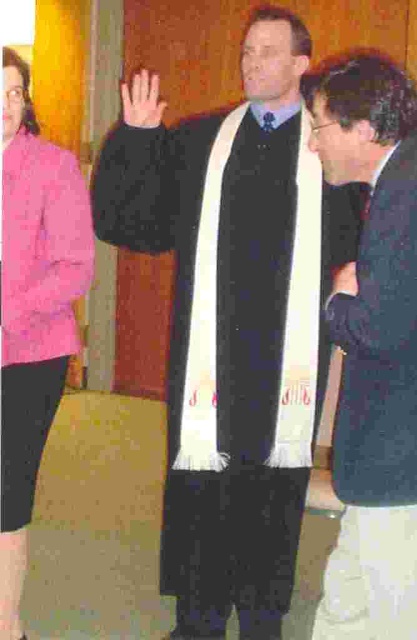
Question: In this image, where is white wool scarf at center located relative to smooth skin hand at center?

Choices:
 (A) below
 (B) above

Answer: (A)

Question: Does white wool scarf at center have a smaller size compared to dark blue suit at center?

Choices:
 (A) no
 (B) yes

Answer: (A)

Question: Is smooth skin hand at center behind matte purple tie at center?

Choices:
 (A) yes
 (B) no

Answer: (B)

Question: Which point appears closest to the camera in this image?

Choices:
 (A) (274, 116)
 (B) (156, 109)

Answer: (B)

Question: Which point is farther to the camera?

Choices:
 (A) (7, 522)
 (B) (120, 92)
 (C) (266, 124)

Answer: (B)

Question: Considering the real-world distances, which object is farthest from the matte purple tie at center?

Choices:
 (A) smooth skin hand at center
 (B) pink fabric jacket at left
 (C) matte black hand at center
 (D) white wool scarf at center

Answer: (B)